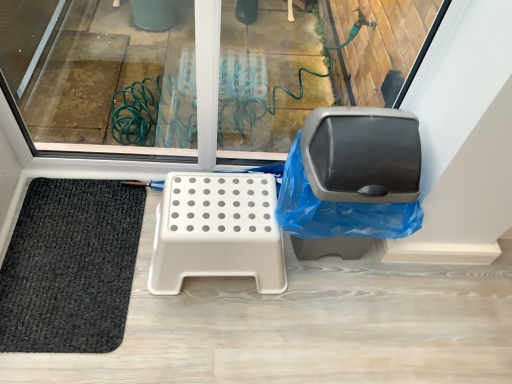
Question: Looking at the image, does black woven mat at lower left seem bigger or smaller compared to matte gray swivel chair at right?

Choices:
 (A) big
 (B) small

Answer: (B)

Question: In the image, is black woven mat at lower left on the left side or the right side of matte gray swivel chair at right?

Choices:
 (A) left
 (B) right

Answer: (A)

Question: Based on their relative distances, which object is farther from the black woven mat at lower left?

Choices:
 (A) matte gray swivel chair at right
 (B) beige plastic step stool at center

Answer: (A)

Question: Estimate the real-world distances between objects in this image. Which object is closer to the matte gray swivel chair at right?

Choices:
 (A) beige plastic step stool at center
 (B) black woven mat at lower left

Answer: (A)